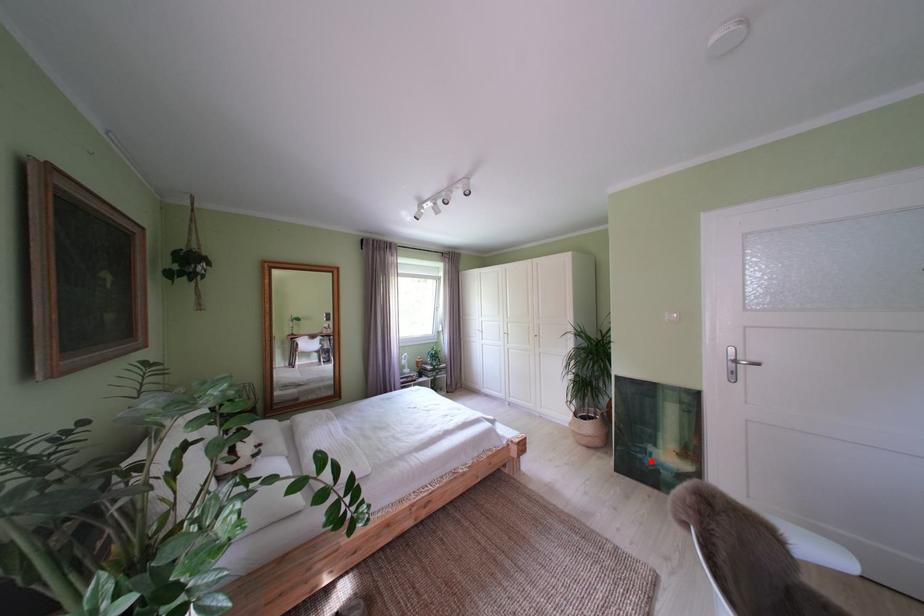
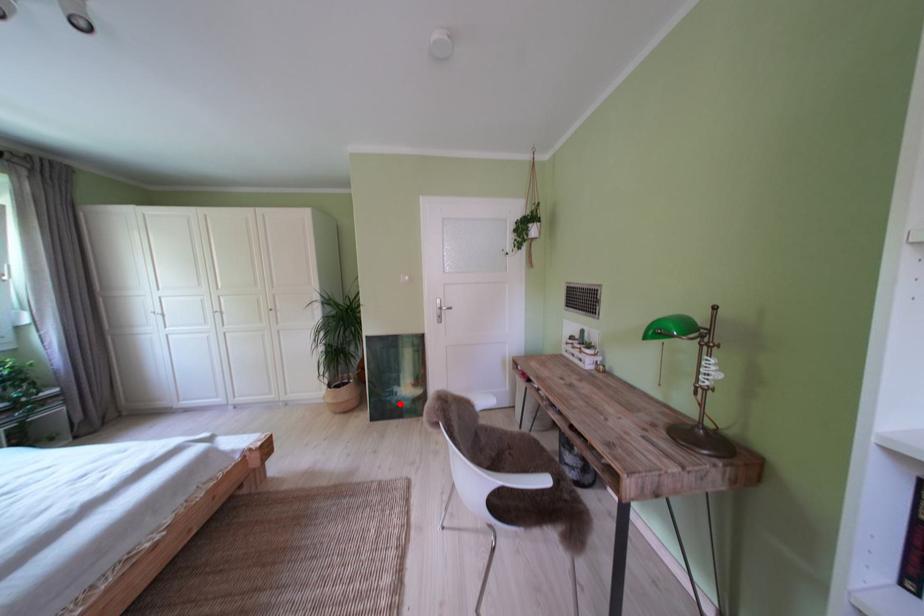
I am providing you with two images of the same scene from different viewpoints. A red point is marked on the first image and another point is marked on the second image. Are the points marked in image1 and image2 representing the same 3D position?

Yes